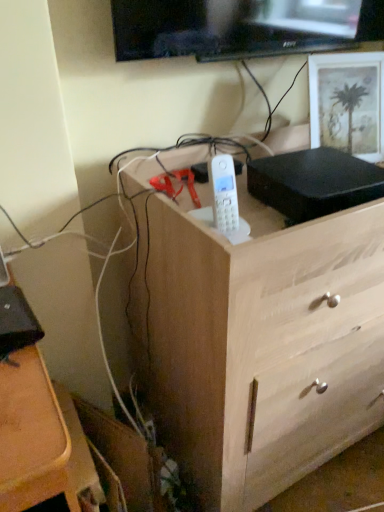
Question: Considering the positions of white matte picture frame at upper right and wooden chest of drawers at center in the image, is white matte picture frame at upper right taller or shorter than wooden chest of drawers at center?

Choices:
 (A) tall
 (B) short

Answer: (B)

Question: Based on their positions, is white matte picture frame at upper right located to the left or right of wooden chest of drawers at center?

Choices:
 (A) right
 (B) left

Answer: (A)

Question: Is white matte picture frame at upper right wider or thinner than wooden chest of drawers at center?

Choices:
 (A) thin
 (B) wide

Answer: (A)

Question: In the image, is wooden chest of drawers at center on the left side or the right side of white matte picture frame at upper right?

Choices:
 (A) right
 (B) left

Answer: (B)

Question: Choose the correct answer: Is wooden chest of drawers at center inside white matte picture frame at upper right or outside it?

Choices:
 (A) outside
 (B) inside

Answer: (A)

Question: From the image's perspective, is wooden chest of drawers at center positioned above or below white matte picture frame at upper right?

Choices:
 (A) below
 (B) above

Answer: (A)

Question: In terms of height, does wooden chest of drawers at center look taller or shorter compared to white matte picture frame at upper right?

Choices:
 (A) short
 (B) tall

Answer: (B)